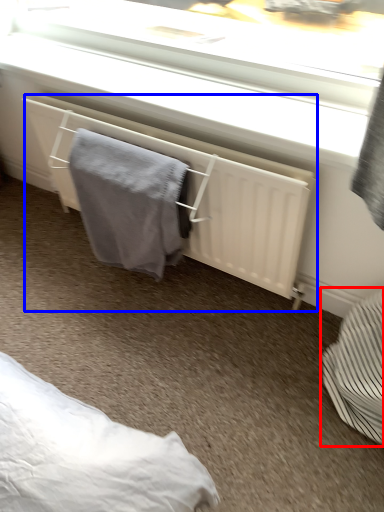
Question: Which object is closer to the camera taking this photo, furniture (highlighted by a red box) or radiator (highlighted by a blue box)?

Choices:
 (A) furniture
 (B) radiator

Answer: (A)